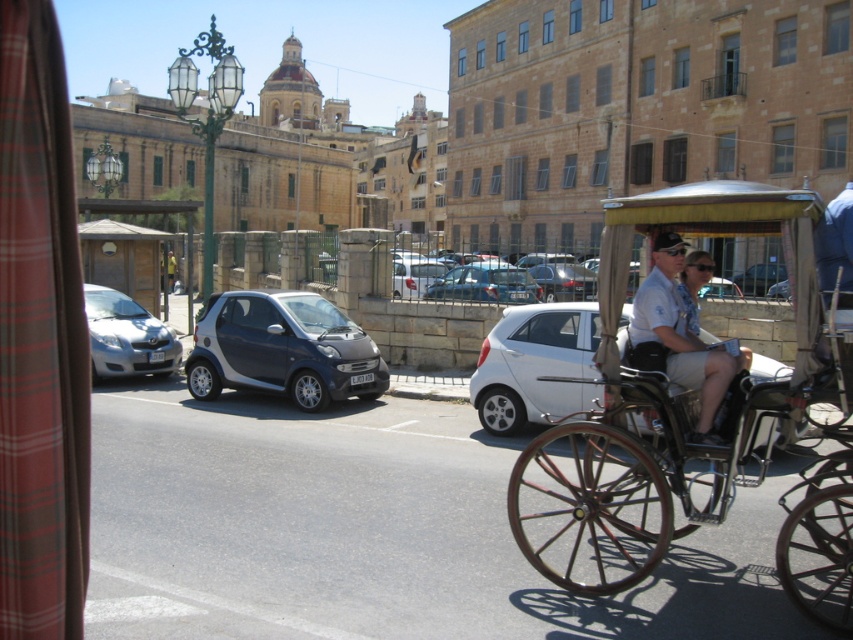
What do you see at coordinates (664, 403) in the screenshot? This screenshot has width=853, height=640. I see `wooden cart at right` at bounding box center [664, 403].

Who is more distant from viewer, (650, 572) or (460, 268)?

The point (460, 268) is behind.

Is point (805, 259) behind point (538, 292)?

No, (805, 259) is closer to viewer.

The height and width of the screenshot is (640, 853). Find the location of `wooden cart at right`. wooden cart at right is located at coordinates (664, 403).

You are a GUI agent. You are given a task and a screenshot of the screen. Output one action in this format:
    pyautogui.click(x=<x>, y=<y>)
    Task: Click on the metallic gray car at center
    This screenshot has width=853, height=640.
    Given the screenshot: What is the action you would take?
    pyautogui.click(x=282, y=349)

The height and width of the screenshot is (640, 853). What do you see at coordinates (282, 349) in the screenshot? I see `metallic gray car at center` at bounding box center [282, 349].

Identify the location of metallic gray car at center. Image resolution: width=853 pixels, height=640 pixels. (282, 349).

From the picture: Which of these two, silver metallic hatchback at left or metallic silver car at center, stands taller?

Standing taller between the two is silver metallic hatchback at left.

Does silver metallic hatchback at left have a larger size compared to metallic silver car at center?

Yes, silver metallic hatchback at left is bigger than metallic silver car at center.

Identify the location of silver metallic hatchback at left. (126, 337).